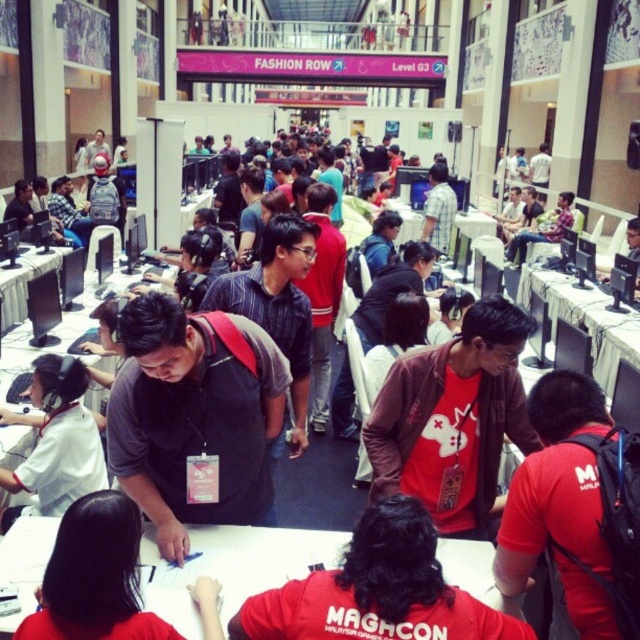
Question: Does dark gray shirt at center appear on the left side of matte black shirt at center?

Choices:
 (A) no
 (B) yes

Answer: (B)

Question: Observing the image, what is the correct spatial positioning of dark gray shirt at center in reference to red matte backpack at lower right?

Choices:
 (A) above
 (B) below

Answer: (A)

Question: Estimate the real-world distances between objects in this image. Which object is closer to the black plastic table at center?

Choices:
 (A) white matte shirt at lower left
 (B) red matte backpack at lower right
 (C) matte black shirt at center

Answer: (B)

Question: Among these objects, which one is farthest from the camera?

Choices:
 (A) white matte shirt at lower left
 (B) white paper at center
 (C) black plastic table at center

Answer: (C)

Question: Is red matte backpack at lower right to the right of matte black shirt at center from the viewer's perspective?

Choices:
 (A) no
 (B) yes

Answer: (A)

Question: Which point appears closest to the camera in this image?

Choices:
 (A) (392, 490)
 (B) (74, 625)
 (C) (22, 259)

Answer: (B)